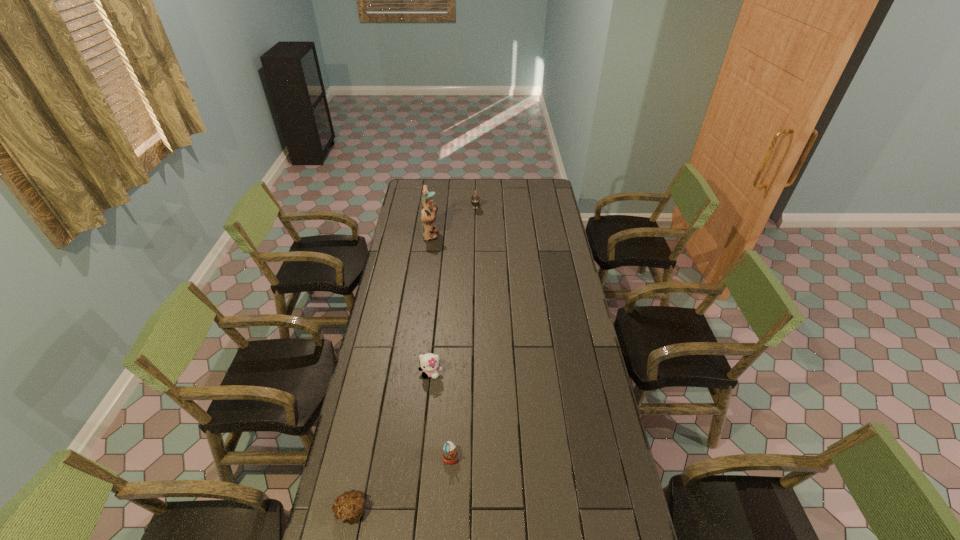
At what (x,y) coordinates should I click in order to perform the action: click on the fourth nearest object. Please return your answer as a coordinate pair (x, y). Looking at the image, I should click on (428, 209).

Where is `the tallest object`? The image size is (960, 540). the tallest object is located at coordinates (428, 209).

This screenshot has width=960, height=540. I want to click on the nearer kitten, so click(x=429, y=363).

The width and height of the screenshot is (960, 540). Find the location of `the third nearest object`. the third nearest object is located at coordinates (429, 363).

The image size is (960, 540). Find the location of `the rightmost object`. the rightmost object is located at coordinates (475, 198).

Identify the location of the farther kitten. (475, 198).

Locate an element on the screen. This screenshot has width=960, height=540. the fourth object from left to right is located at coordinates (450, 454).

Identify the location of the taller muffin. (450, 454).

I want to click on the left muffin, so click(349, 506).

Image resolution: width=960 pixels, height=540 pixels. Find the location of `the shortest object`. the shortest object is located at coordinates (349, 506).